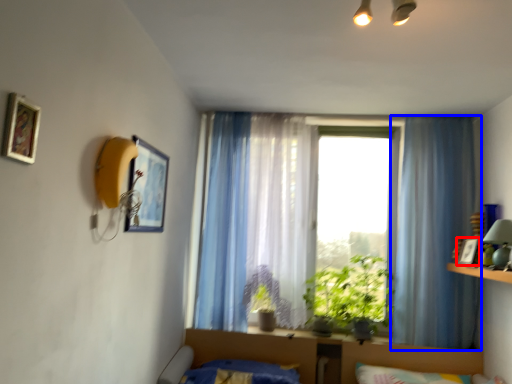
Question: Which object appears farthest to the camera in this image, picture frame (highlighted by a red box) or curtain (highlighted by a blue box)?

Choices:
 (A) picture frame
 (B) curtain

Answer: (B)